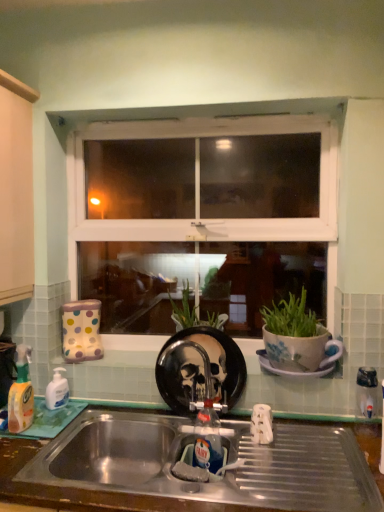
Where is `free point in front of white opaque plastic bottle at left, the first bottle when ordered from back to front`? free point in front of white opaque plastic bottle at left, the first bottle when ordered from back to front is located at coordinates (50, 421).